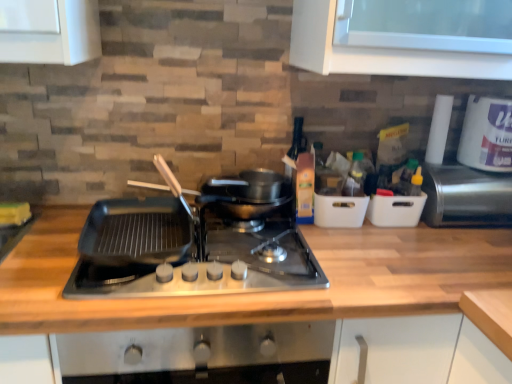
Question: Is white plastic container at right, marked as the 2th appliance in a right-to-left arrangement, positioned with its back to metallic stainless steel toaster at right, the 1th appliance positioned from the right?

Choices:
 (A) no
 (B) yes

Answer: (A)

Question: Does white plastic container at right, marked as the 2th appliance in a right-to-left arrangement, have a smaller size compared to metallic stainless steel toaster at right, the 1th appliance positioned from the right?

Choices:
 (A) no
 (B) yes

Answer: (B)

Question: Could metallic stainless steel toaster at right, the 1th appliance positioned from the right, be considered to be inside white plastic container at right, marked as the 2th appliance in a right-to-left arrangement?

Choices:
 (A) yes
 (B) no

Answer: (B)

Question: Are white plastic container at right, marked as the 2th appliance in a right-to-left arrangement, and metallic stainless steel toaster at right, which is counted as the 2th appliance, starting from the left, making contact?

Choices:
 (A) no
 (B) yes

Answer: (A)

Question: Is the position of white plastic container at right, the 1th appliance when ordered from left to right, more distant than that of metallic stainless steel toaster at right, which is counted as the 2th appliance, starting from the left?

Choices:
 (A) no
 (B) yes

Answer: (B)

Question: Can you confirm if white plastic container at right, the 1th appliance when ordered from left to right, is shorter than metallic stainless steel toaster at right, which is counted as the 2th appliance, starting from the left?

Choices:
 (A) no
 (B) yes

Answer: (B)

Question: Is white plastic container at upper right not within wooden at center?

Choices:
 (A) no
 (B) yes

Answer: (B)

Question: Is white plastic container at upper right surrounding wooden at center?

Choices:
 (A) no
 (B) yes

Answer: (A)

Question: Does white plastic container at upper right have a lesser width compared to wooden at center?

Choices:
 (A) yes
 (B) no

Answer: (A)

Question: Considering the relative sizes of white plastic container at upper right and wooden at center in the image provided, is white plastic container at upper right taller than wooden at center?

Choices:
 (A) yes
 (B) no

Answer: (B)

Question: Considering the relative sizes of white plastic container at upper right and wooden at center in the image provided, is white plastic container at upper right shorter than wooden at center?

Choices:
 (A) no
 (B) yes

Answer: (B)

Question: Is white plastic container at upper right wider than wooden at center?

Choices:
 (A) no
 (B) yes

Answer: (A)

Question: From the image's perspective, is white plastic container at right, the 1th appliance when ordered from left to right, located beneath white plastic container at upper right?

Choices:
 (A) yes
 (B) no

Answer: (A)